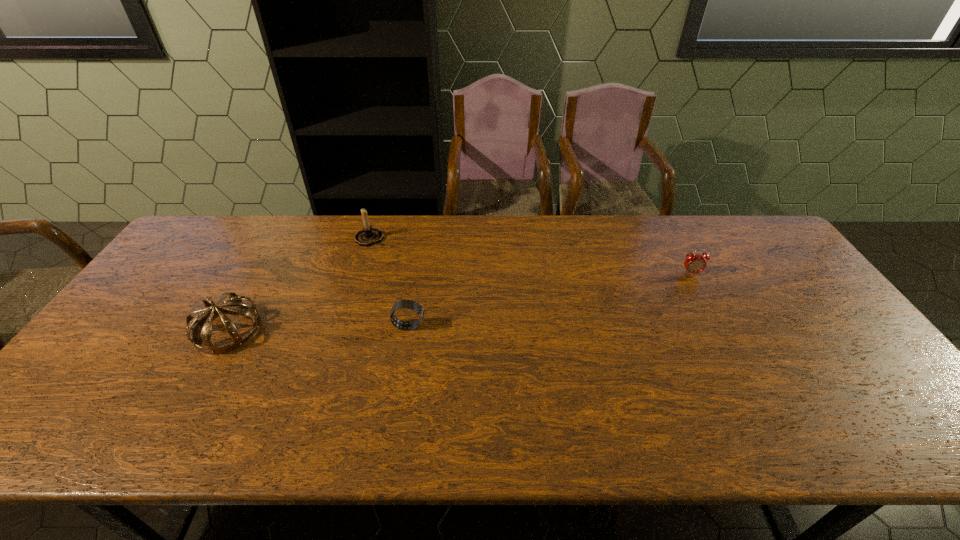
I want to click on blank area in the image that satisfies the following two spatial constraints: 1. on the face of the rightmost object; 2. on the face of the watch, so pos(720,326).

In order to click on free space that satisfies the following two spatial constraints: 1. on the back side of the third object from right to left; 2. on the left side of the tiara in this screenshot , I will do `click(279, 238)`.